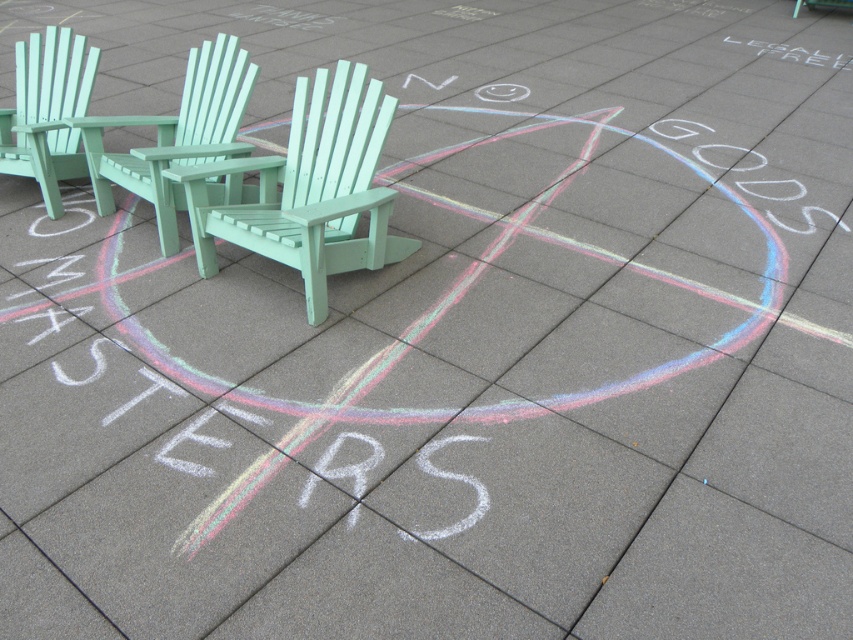
You are sitting in the mint green plastic beach chair at center and want to see the white chalk smiley face at center. Can you see it without moving your head?

The mint green plastic beach chair at center is in front of the white chalk smiley face at center, so the chair would block your view of the smiley face unless you move your head or position yourself to look around it.

Based on the photo, you are standing in the paved outdoor area and want to place a small potted plant between the white chalk circle at lower left and the white chalk smiley face at center. Which object should you place the plant closer to if you want it to be closer to the shorter one?

You should place the plant closer to the white chalk circle at lower left because it is shorter than the white chalk smiley face at center.

You are standing at the center of the paved area and want to place a small potted plant. You have two options for placement based on the coordinates given in the image. Which coordinate point, point [222,70] or point [483,86], is closer to you so that the plant is more visible from where you are standing?

Point [222,70] is closer to the viewer than point [483,86], so placing the potted plant there would make it more visible from your current position at the center of the paved area.